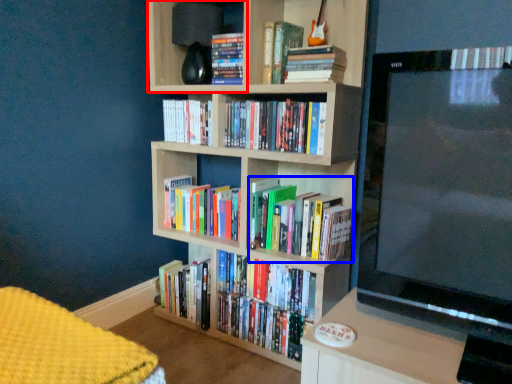
Question: Which object is further to the camera taking this photo, shelf (highlighted by a red box) or book (highlighted by a blue box)?

Choices:
 (A) shelf
 (B) book

Answer: (A)